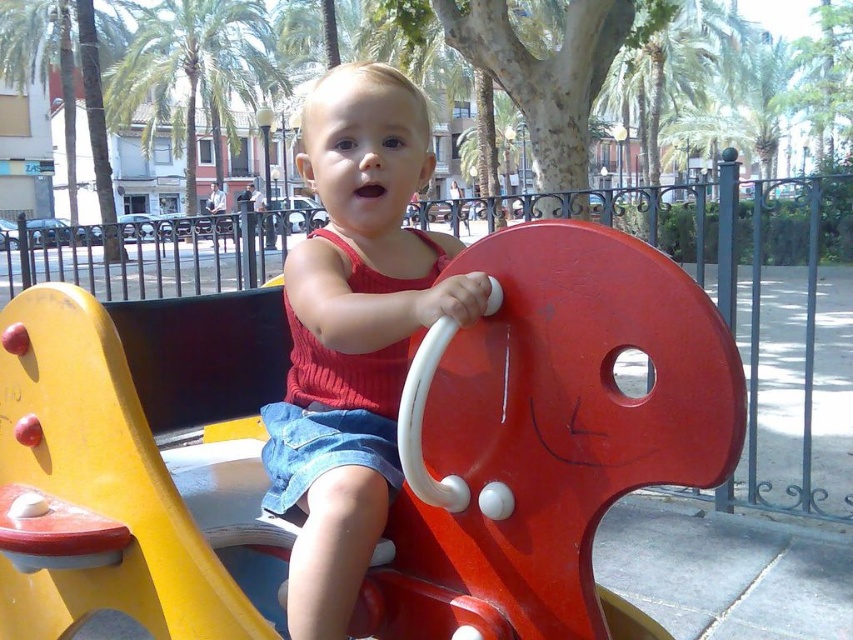
Is matte plastic horse at center above matte red swing at center?

Actually, matte plastic horse at center is below matte red swing at center.

Locate an element on the screen. Image resolution: width=853 pixels, height=640 pixels. matte plastic horse at center is located at coordinates [x=547, y=436].

Image resolution: width=853 pixels, height=640 pixels. Identify the location of matte plastic horse at center. [x=547, y=436].

Identify the location of matte plastic horse at center. This screenshot has height=640, width=853. (547, 436).

Is matte plastic horse at center closer to the viewer compared to green leafy palm tree at upper left?

Yes, it is.

Is matte plastic horse at center above green leafy palm tree at upper left?

No.

Locate an element on the screen. The width and height of the screenshot is (853, 640). matte plastic horse at center is located at coordinates (547, 436).

Between matte red swing at center and green leafy palm tree at upper left, which one is positioned lower?

matte red swing at center is lower down.

Where is `matte red swing at center`? The width and height of the screenshot is (853, 640). matte red swing at center is located at coordinates point(352,333).